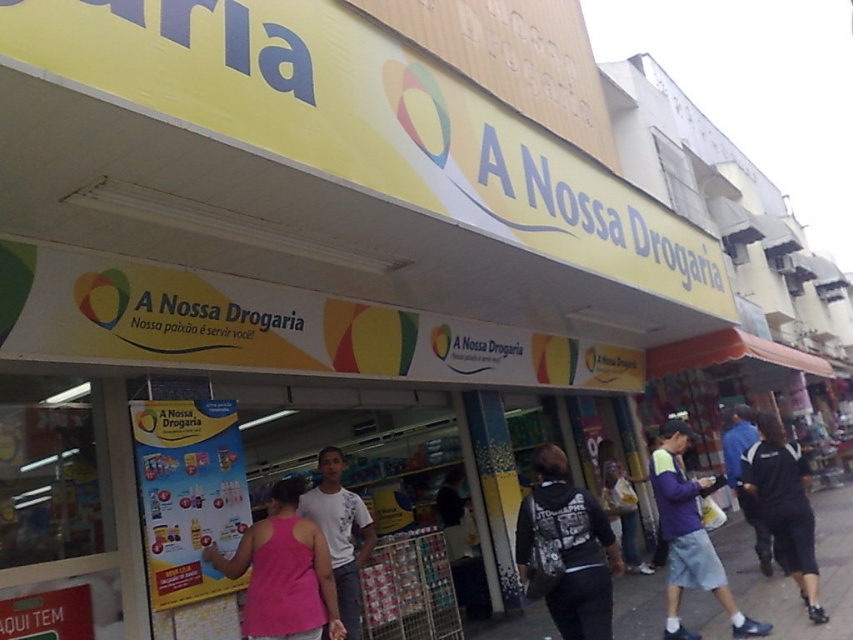
Question: Does pink fabric tank top at center have a greater width compared to denim jacket at lower right?

Choices:
 (A) yes
 (B) no

Answer: (A)

Question: Which point is farther to the camera?

Choices:
 (A) dark blue jacket at center
 (B) pink fabric tank top at center
 (C) black cotton shirt at lower right

Answer: (A)

Question: Does smooth concrete pavement at lower center have a lesser width compared to pink fabric tank top at center?

Choices:
 (A) no
 (B) yes

Answer: (B)

Question: Which object appears closest to the camera in this image?

Choices:
 (A) white cotton t-shirt at center
 (B) black backpack at center

Answer: (B)

Question: Which object is farther from the camera taking this photo?

Choices:
 (A) purple cotton hoodie at center
 (B) denim jacket at lower right

Answer: (B)

Question: Is purple cotton hoodie at center smaller than black cotton shirt at lower right?

Choices:
 (A) yes
 (B) no

Answer: (B)